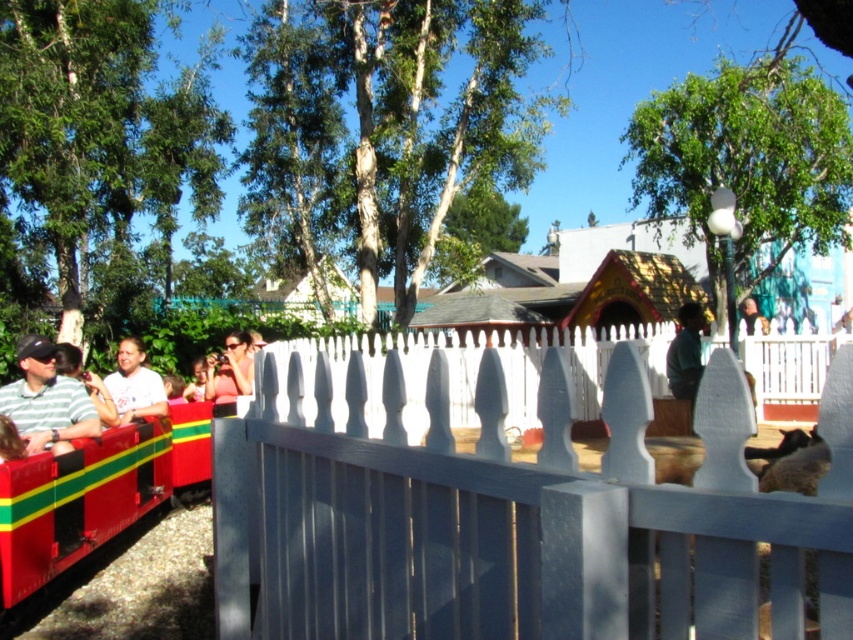
Who is higher up, matte pink sunglasses at center or smooth skin face at upper center?

smooth skin face at upper center

Describe the element at coordinates (230, 369) in the screenshot. The image size is (853, 640). I see `matte pink sunglasses at center` at that location.

Is point (247, 371) farther from camera compared to point (763, 333)?

No.

The image size is (853, 640). What are the coordinates of `matte pink sunglasses at center` in the screenshot? It's located at (230, 369).

Does striped green and white shirt at left have a greater height compared to smooth skin face at upper center?

Incorrect, striped green and white shirt at left's height is not larger of smooth skin face at upper center's.

Who is lower down, striped green and white shirt at left or smooth skin face at upper center?

striped green and white shirt at left is lower down.

Locate an element on the screen. striped green and white shirt at left is located at coordinates (45, 401).

Is matte white shirt at center closer to camera compared to matte pink sunglasses at center?

Yes, matte white shirt at center is in front of matte pink sunglasses at center.

This screenshot has height=640, width=853. Describe the element at coordinates (134, 385) in the screenshot. I see `matte white shirt at center` at that location.

You are a GUI agent. You are given a task and a screenshot of the screen. Output one action in this format:
    pyautogui.click(x=<x>, y=<y>)
    Task: Click on the matte white shirt at center
    
    Given the screenshot: What is the action you would take?
    pyautogui.click(x=134, y=385)